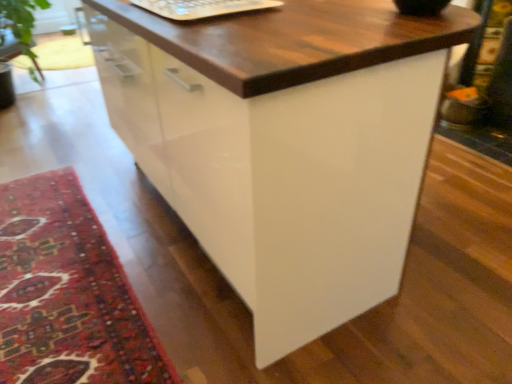
You are a GUI agent. You are given a task and a screenshot of the screen. Output one action in this format:
    pyautogui.click(x=<x>, y=<y>)
    Task: Click on the blank space above carpeted rug at lower left (from a real-world perspective)
    This screenshot has height=384, width=512.
    Given the screenshot: What is the action you would take?
    (x=54, y=256)